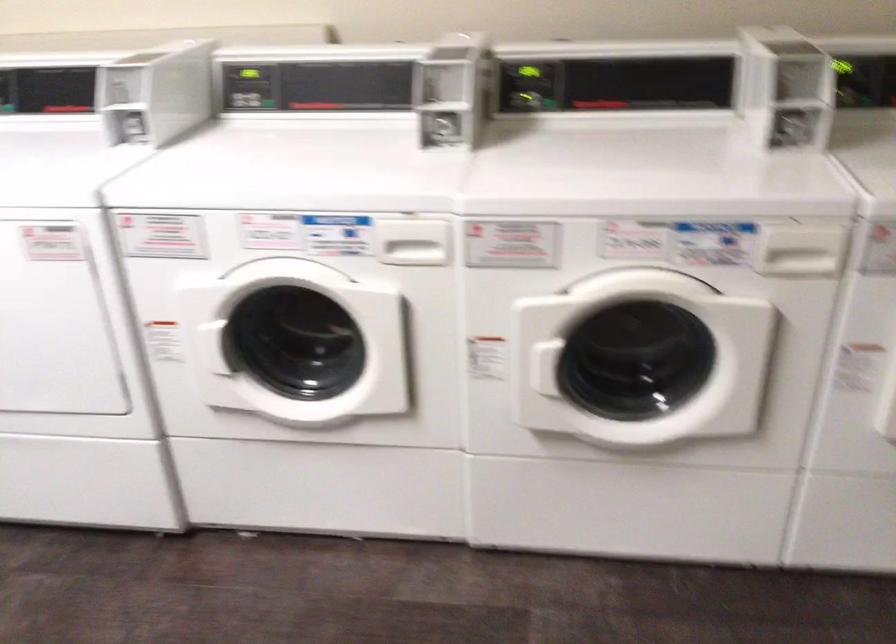
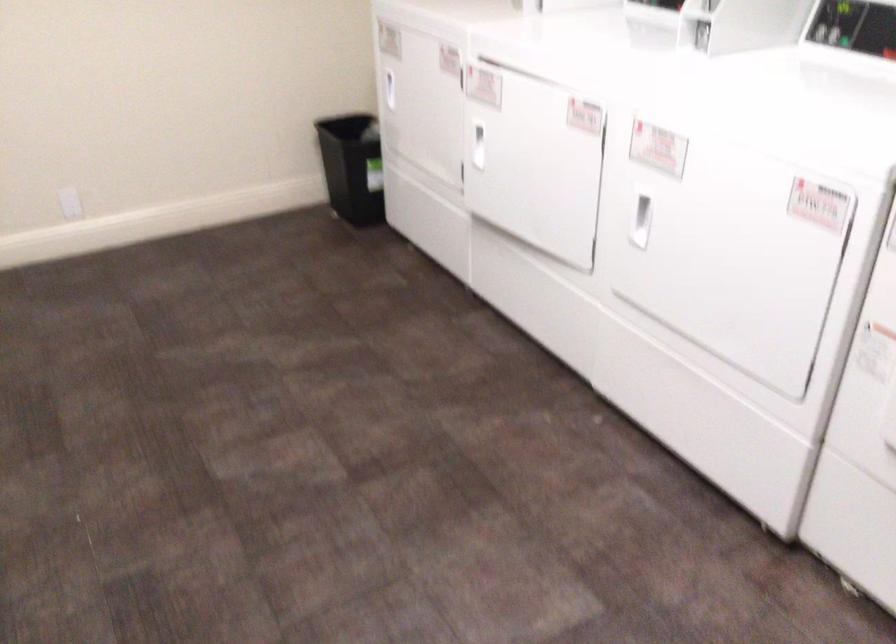
Question: The images are taken continuously from a first-person perspective. In which direction is your viewpoint rotating?

Choices:
 (A) Left
 (B) Right
 (C) Up
 (D) Down

Answer: (A)